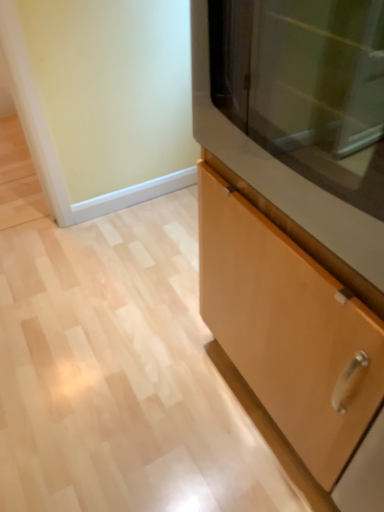
Find the location of `blank space to the left of light wood cabinet at center`. blank space to the left of light wood cabinet at center is located at coordinates (140, 387).